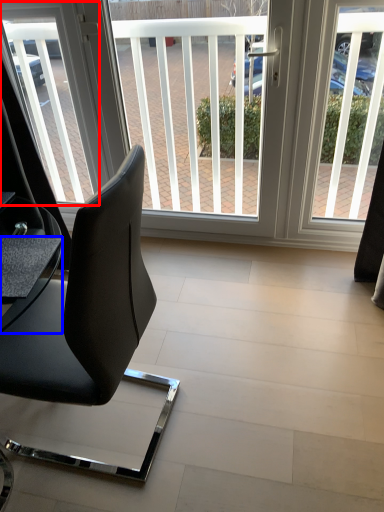
Question: Which object is closer to the camera taking this photo, window screen (highlighted by a red box) or table (highlighted by a blue box)?

Choices:
 (A) window screen
 (B) table

Answer: (B)